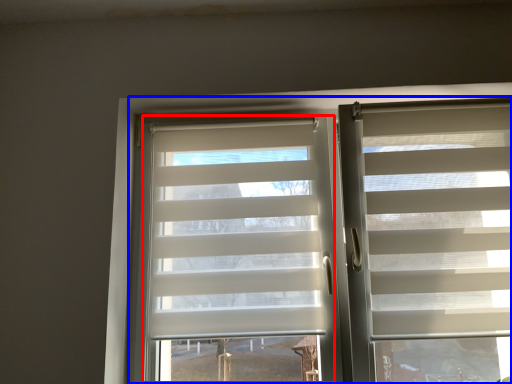
Question: Which of the following is the farthest to the observer, glass door (highlighted by a red box) or bay window (highlighted by a blue box)?

Choices:
 (A) glass door
 (B) bay window

Answer: (A)